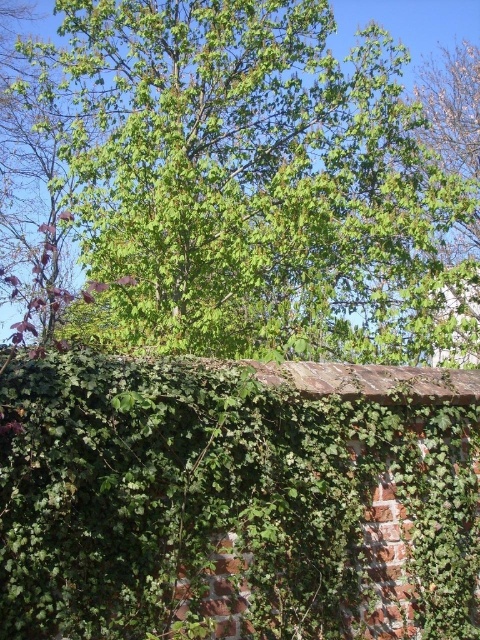
You are standing in front of the brick wall and looking upwards. Which object is positioned higher between the green leafy tree at upper center and the green leafy hedge at upper center?

The green leafy tree at upper center is positioned higher than the green leafy hedge at upper center because it is located above it.

Based on the scene description, which object is wider between the green leafy tree at upper center and the green leafy hedge at upper center?

The green leafy tree at upper center is wider than the green leafy hedge at upper center according to the description.

From the picture: You are standing in front of the brick wall and want to walk towards the green leafy tree at upper center and the green leafy hedge at upper center. Which one should you walk towards if you want to go to the right side of the hedge?

You should walk towards the green leafy tree at upper center because it is positioned to the right of the green leafy hedge at upper center.